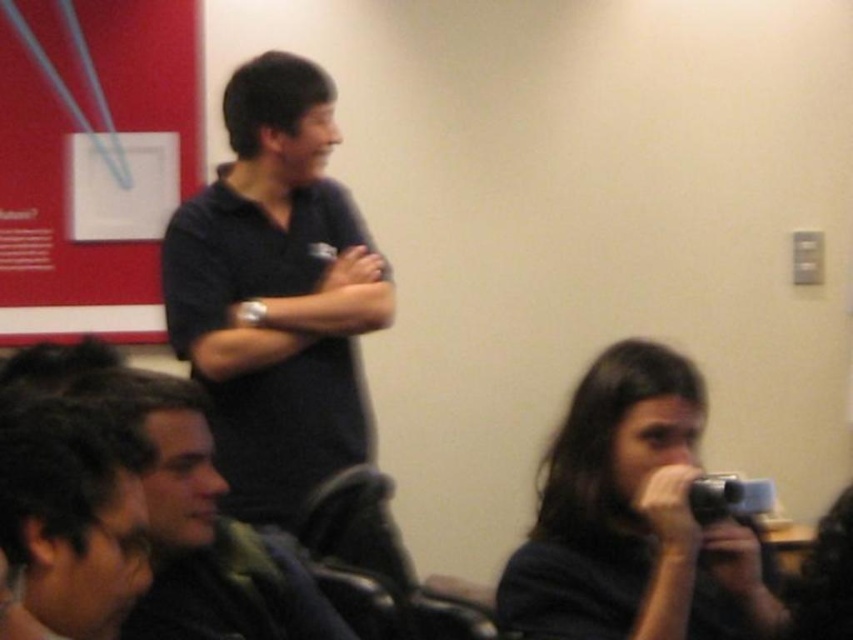
Describe the element at coordinates (202, 525) in the screenshot. The width and height of the screenshot is (853, 640). I see `matte black shirt at center` at that location.

Which is more to the right, matte black shirt at center or dark brown hair at lower left?

Positioned to the right is matte black shirt at center.

The image size is (853, 640). Describe the element at coordinates (202, 525) in the screenshot. I see `matte black shirt at center` at that location.

This screenshot has width=853, height=640. Identify the location of matte black shirt at center. (202, 525).

From the picture: How distant is black matte shirt at center from matte black shirt at center?

They are 57.42 centimeters apart.

Who is positioned more to the left, black matte shirt at center or matte black shirt at center?

matte black shirt at center is more to the left.

Does point (271, 234) come behind point (161, 497)?

Yes, point (271, 234) is behind point (161, 497).

This screenshot has width=853, height=640. Find the location of `black matte shirt at center`. black matte shirt at center is located at coordinates (276, 292).

Is point (764, 620) positioned in front of point (262, 600)?

Yes, point (764, 620) is in front of point (262, 600).

How distant is dark matte camera at lower right from matte black shirt at center?

dark matte camera at lower right and matte black shirt at center are 19.28 inches apart from each other.

Does point (740, 614) come behind point (151, 416)?

Yes.

This screenshot has width=853, height=640. In order to click on dark matte camera at lower right in this screenshot , I will do `click(634, 518)`.